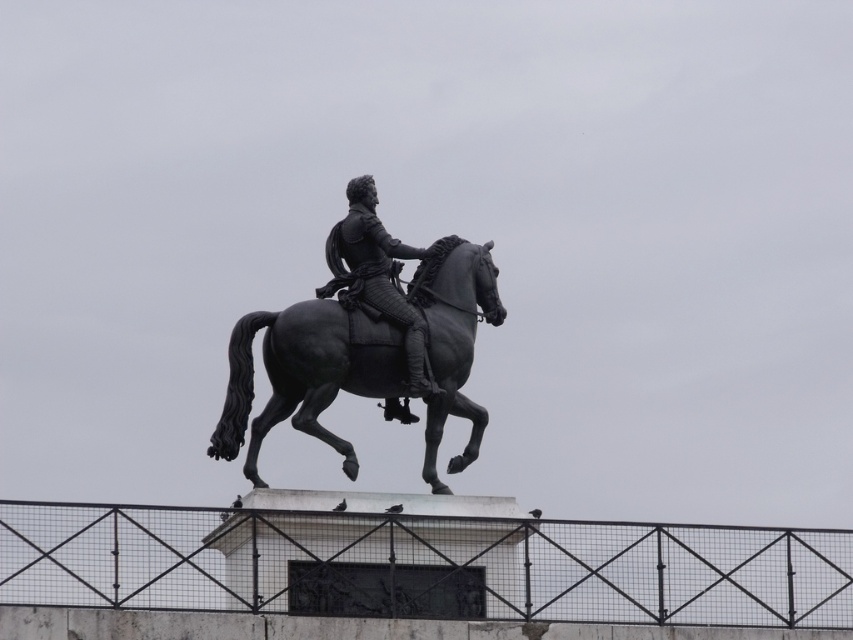
You are standing in a park and see the black metal fence at center and the polished bronze statue at center. Which object is positioned higher from the ground?

The polished bronze statue at center is positioned higher from the ground than the black metal fence at center because the black metal fence at center is below it.

You are a tourist standing in front of the equestrian statue. You want to take a photo of the polished black horse at center. Considering the distance, can you capture the entire statue in your camera frame without moving closer?

The polished black horse at center is 112.95 meters away from the viewer. Since this distance is quite far, it is unlikely that you can capture the entire statue in your camera frame without using a zoom lens or moving closer.